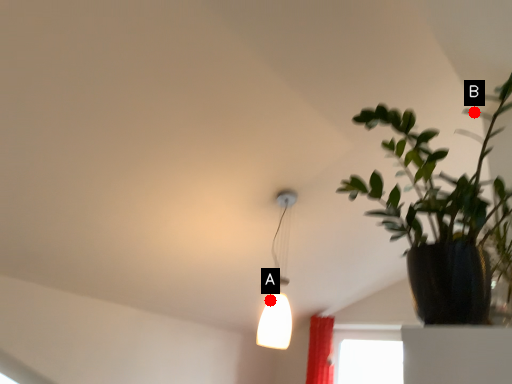
Question: Two points are circled on the image, labeled by A and B beside each circle. Which point appears closest to the camera in this image?

Choices:
 (A) A is closer
 (B) B is closer

Answer: (B)